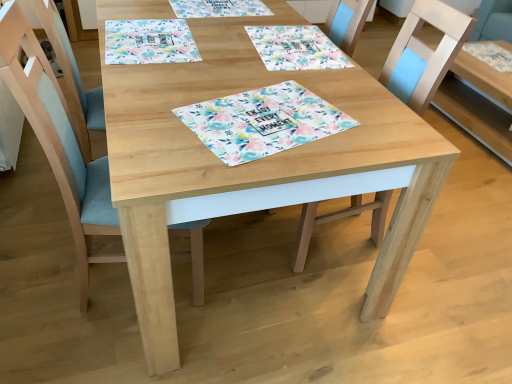
Identify the location of free space to the right of floral paper placemat at center. (369, 124).